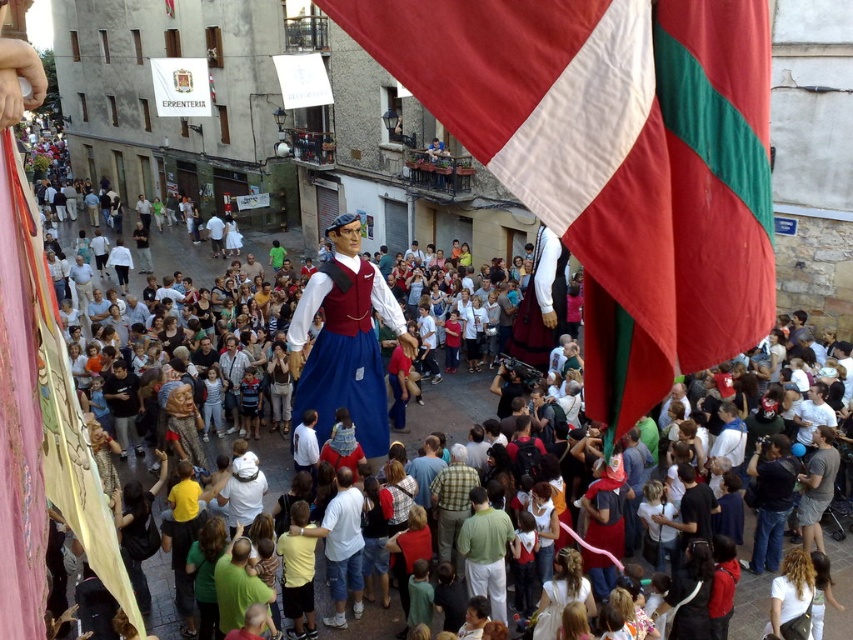
Question: Which of the following is the farthest from the observer?

Choices:
 (A) red fabric flag at center
 (B) green plaid shirt at center
 (C) velvet blue costume at center

Answer: (C)

Question: Can you confirm if red fabric flag at center is positioned to the right of velvet blue costume at center?

Choices:
 (A) yes
 (B) no

Answer: (A)

Question: Among these objects, which one is nearest to the camera?

Choices:
 (A) red fabric flag at center
 (B) velvet blue costume at center
 (C) green plaid shirt at center
 (D) green cotton shirt at center

Answer: (A)

Question: From the image, what is the correct spatial relationship of velvet blue costume at center in relation to green plaid shirt at center?

Choices:
 (A) below
 (B) above

Answer: (B)

Question: Does red fabric flag at center appear over velvet blue costume at center?

Choices:
 (A) yes
 (B) no

Answer: (B)

Question: Among these objects, which one is nearest to the camera?

Choices:
 (A) red fabric flag at center
 (B) green cotton shirt at center
 (C) velvet blue costume at center

Answer: (A)